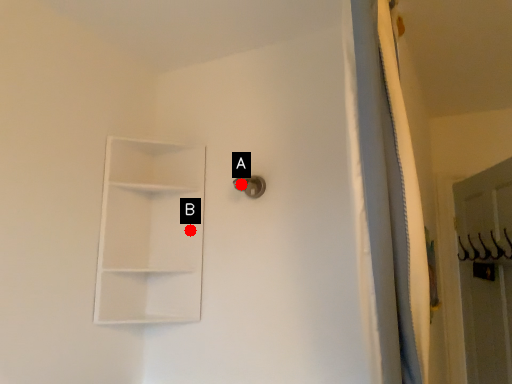
Question: Two points are circled on the image, labeled by A and B beside each circle. Among these points, which one is farthest from the camera?

Choices:
 (A) A is further
 (B) B is further

Answer: (B)